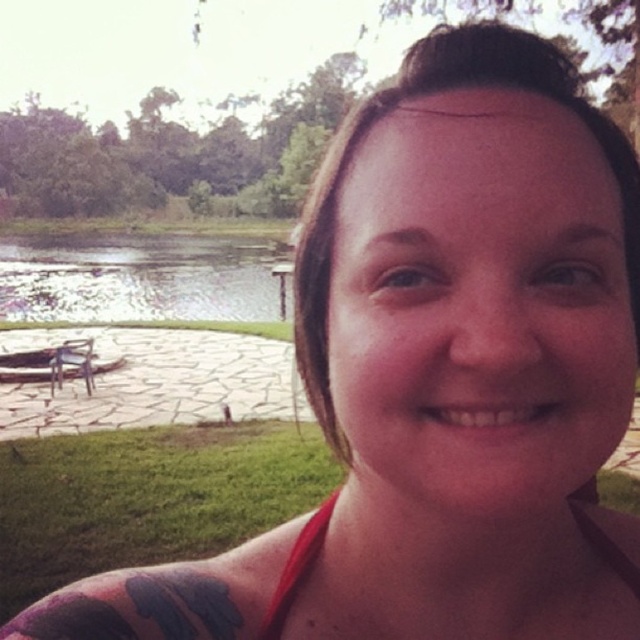
Does clear water at lake left lie behind red fabric bikini top at lower center?

Yes, clear water at lake left is further from the viewer.

Which is above, clear water at lake left or red fabric bikini top at lower center?

Positioned higher is clear water at lake left.

Between point (131, 292) and point (305, 554), which one is positioned in front?

Point (305, 554) is more forward.

I want to click on clear water at lake left, so click(138, 278).